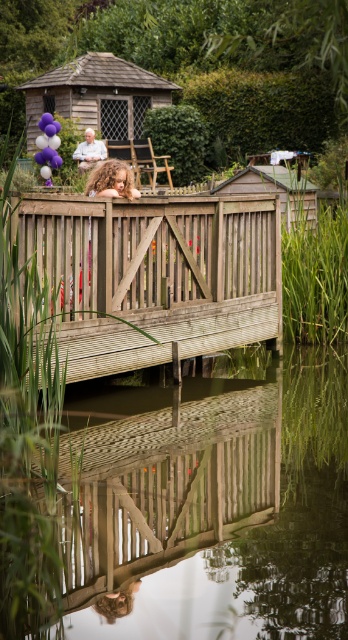
Question: Which point appears closest to the camera in this image?

Choices:
 (A) (271, 464)
 (B) (95, 83)
 (C) (33, 225)
 (D) (127, 193)

Answer: (A)

Question: Which point is farther to the camera?

Choices:
 (A) click(44, 124)
 (B) click(133, 189)
 (C) click(98, 161)

Answer: (C)

Question: Does wooden gazebo at upper center have a larger size compared to curly blonde hair at upper center?

Choices:
 (A) yes
 (B) no

Answer: (A)

Question: Which of the following is the farthest from the observer?

Choices:
 (A) (88, 97)
 (B) (186, 324)
 (C) (100, 182)
 (D) (44, 150)

Answer: (A)

Question: Does curly blonde hair at upper center appear on the right side of matte white shirt at upper center?

Choices:
 (A) yes
 (B) no

Answer: (A)

Question: In this image, where is wooden bridge at center located relative to matte white shirt at upper center?

Choices:
 (A) above
 (B) below

Answer: (B)